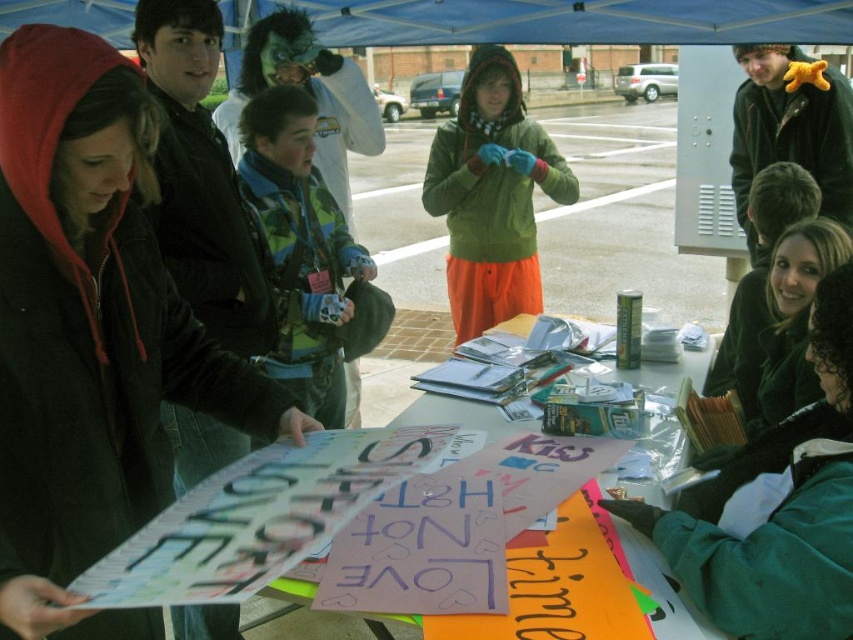
Is blue fabric canopy at upper center shorter than cardboard posters at center?

Yes, blue fabric canopy at upper center is shorter than cardboard posters at center.

Does blue fabric canopy at upper center have a larger size compared to cardboard posters at center?

Yes.

Who is more forward, (80, 4) or (682, 440)?

Positioned in front is point (682, 440).

You are a GUI agent. You are given a task and a screenshot of the screen. Output one action in this format:
    pyautogui.click(x=<x>, y=<y>)
    Task: Click on the blue fabric canopy at upper center
    The image size is (853, 640).
    Given the screenshot: What is the action you would take?
    pyautogui.click(x=561, y=20)

Is point (100, 627) in front of point (465, 259)?

Yes, point (100, 627) is closer to viewer.

Locate an element on the screen. The image size is (853, 640). black hoodie at left is located at coordinates (91, 333).

The image size is (853, 640). I want to click on black hoodie at left, so pyautogui.click(x=91, y=333).

Which is in front, point (344, 36) or point (517, 211)?

Positioned in front is point (517, 211).

Is blue fabric canopy at upper center above green matte jacket at center?

Indeed, blue fabric canopy at upper center is positioned over green matte jacket at center.

At what (x,y) coordinates should I click in order to perform the action: click on blue fabric canopy at upper center. Please return your answer as a coordinate pair (x, y). The height and width of the screenshot is (640, 853). Looking at the image, I should click on (561, 20).